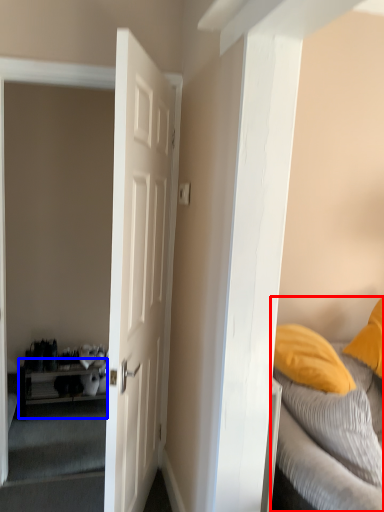
Question: Which of the following is the closest to the observer, bed (highlighted by a red box) or table (highlighted by a blue box)?

Choices:
 (A) bed
 (B) table

Answer: (A)